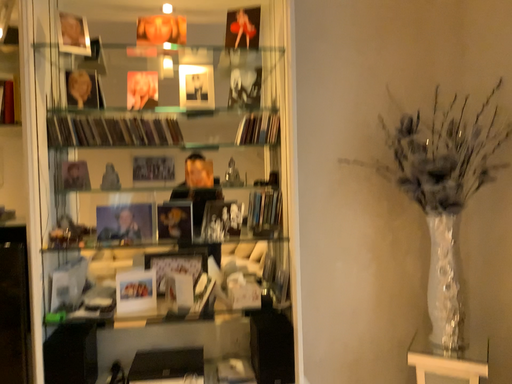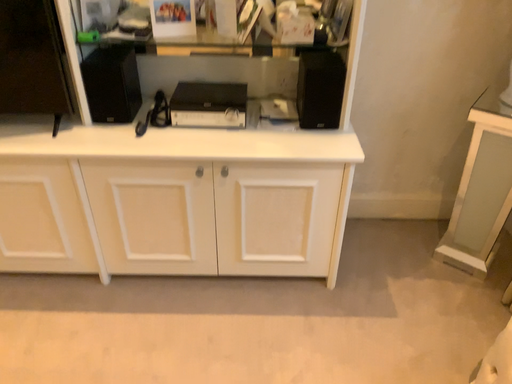
Question: Which way did the camera rotate in the video?

Choices:
 (A) rotated downward
 (B) rotated upward

Answer: (A)